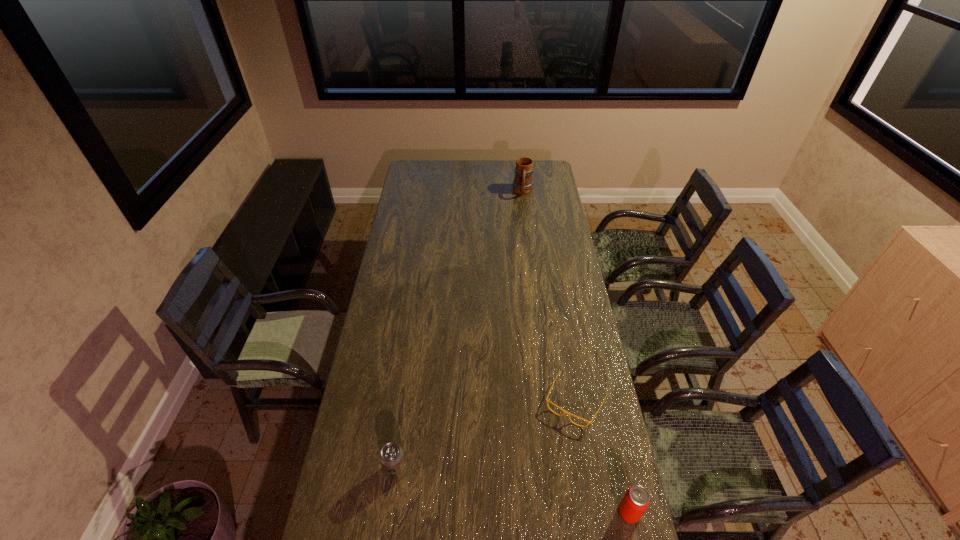
Where is `free space located in front of the lenses of the spectacles`? The height and width of the screenshot is (540, 960). free space located in front of the lenses of the spectacles is located at coordinates (533, 482).

The width and height of the screenshot is (960, 540). I want to click on free space located in front of the lenses of the spectacles, so click(x=533, y=482).

The height and width of the screenshot is (540, 960). Find the location of `vacant region located 0.190m in front of the lenses of the spectacles`. vacant region located 0.190m in front of the lenses of the spectacles is located at coordinates (537, 474).

This screenshot has height=540, width=960. Identify the location of vacant area located 0.340m on the side of the tallest object with the handle. (x=521, y=238).

You are a GUI agent. You are given a task and a screenshot of the screen. Output one action in this format:
    pyautogui.click(x=<x>, y=<y>)
    Task: Click on the free space located on the side of the tallest object with the handle
    This screenshot has width=960, height=540.
    Given the screenshot: What is the action you would take?
    pyautogui.click(x=521, y=232)

Where is `blank space located 0.130m on the side of the tallest object with the handle`? The image size is (960, 540). blank space located 0.130m on the side of the tallest object with the handle is located at coordinates (522, 213).

Locate an element on the screen. The height and width of the screenshot is (540, 960). object at the near edge is located at coordinates (636, 500).

The image size is (960, 540). In order to click on object at the left edge in this screenshot , I will do `click(391, 456)`.

Where is `beer can that is positioned at the right edge`? This screenshot has width=960, height=540. beer can that is positioned at the right edge is located at coordinates (636, 500).

Locate an element on the screen. Image resolution: width=960 pixels, height=540 pixels. spectacles present at the right edge is located at coordinates (565, 412).